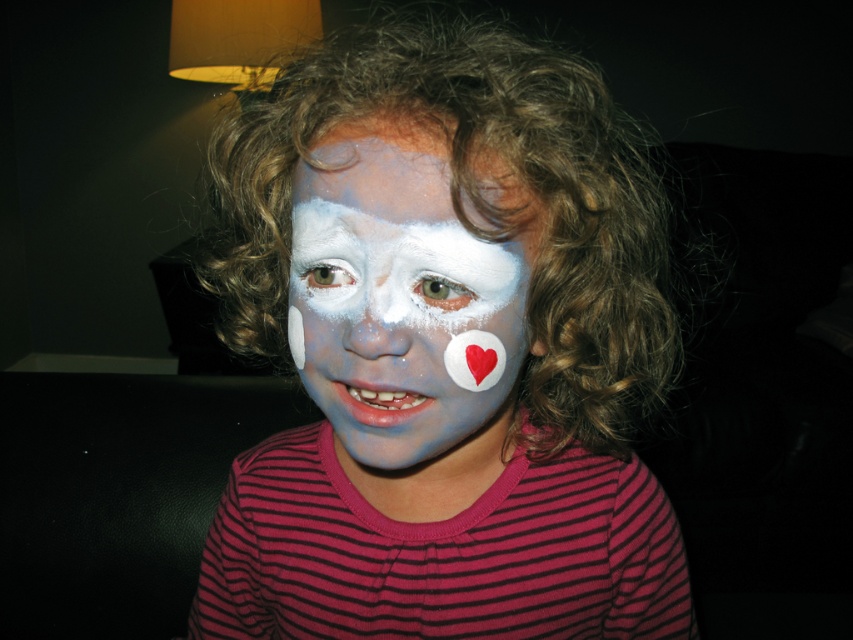
Can you confirm if curly brown hair at center is smaller than white matte nose at center?

No, curly brown hair at center is not smaller than white matte nose at center.

Which is in front, point (459, 113) or point (357, 353)?

Point (459, 113) is more forward.

Where is `curly brown hair at center`? curly brown hair at center is located at coordinates (473, 205).

Can you confirm if white matte face paint at center is shorter than white matte nose at center?

No.

Between white matte face paint at center and white matte nose at center, which one has more height?

white matte face paint at center

Image resolution: width=853 pixels, height=640 pixels. Identify the location of white matte face paint at center. (405, 301).

Image resolution: width=853 pixels, height=640 pixels. In order to click on white matte face paint at center in this screenshot , I will do `click(405, 301)`.

Does curly brown hair at center have a larger size compared to white matte face paint at center?

Indeed, curly brown hair at center has a larger size compared to white matte face paint at center.

Does curly brown hair at center have a smaller size compared to white matte face paint at center?

Incorrect, curly brown hair at center is not smaller in size than white matte face paint at center.

You are a GUI agent. You are given a task and a screenshot of the screen. Output one action in this format:
    pyautogui.click(x=<x>, y=<y>)
    Task: Click on the curly brown hair at center
    
    Given the screenshot: What is the action you would take?
    pyautogui.click(x=473, y=205)